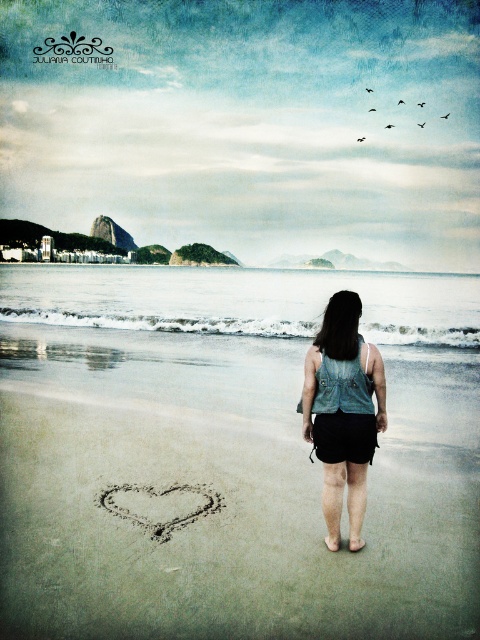
Can you confirm if smooth sand heart at center is positioned below denim vest at center?

Yes.

Is point (90, 337) farther from viewer compared to point (338, 506)?

Yes, it is behind point (338, 506).

You are a GUI agent. You are given a task and a screenshot of the screen. Output one action in this format:
    pyautogui.click(x=<x>, y=<y>)
    Task: Click on the smooth sand heart at center
    
    Given the screenshot: What is the action you would take?
    pyautogui.click(x=225, y=492)

You are a GUI agent. You are given a task and a screenshot of the screen. Output one action in this format:
    pyautogui.click(x=<x>, y=<y>)
    Task: Click on the denim vest at center
    This screenshot has width=480, height=640.
    Given the screenshot: What is the action you would take?
    pyautogui.click(x=343, y=412)

Between point (314, 442) and point (135, 484), which one is positioned behind?

The point (135, 484) is behind.

Locate an element on the screen. The width and height of the screenshot is (480, 640). denim vest at center is located at coordinates (343, 412).

Which is in front, point (59, 401) or point (157, 499)?

Positioned in front is point (157, 499).

The width and height of the screenshot is (480, 640). I want to click on smooth sand heart at center, so click(x=225, y=492).

At what (x,y) coordinates should I click in order to perform the action: click on smooth sand heart at center. Please return your answer as a coordinate pair (x, y). Looking at the image, I should click on (225, 492).

You are a GUI agent. You are given a task and a screenshot of the screen. Output one action in this format:
    pyautogui.click(x=<x>, y=<y>)
    Task: Click on the smooth sand heart at center
    Image resolution: width=480 pixels, height=640 pixels.
    Given the screenshot: What is the action you would take?
    pyautogui.click(x=225, y=492)